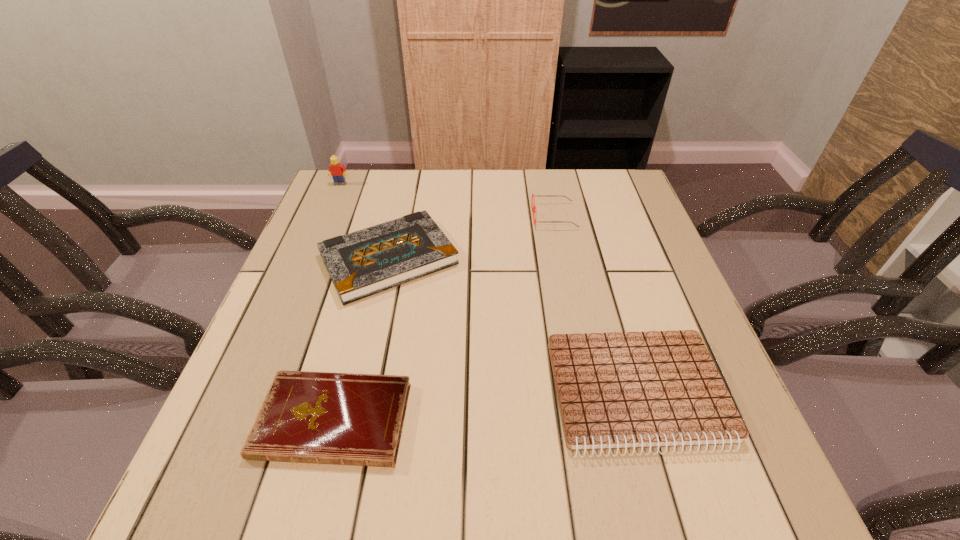
Where is `blank space located on the front-facing side of the spectacles`? This screenshot has width=960, height=540. blank space located on the front-facing side of the spectacles is located at coordinates (419, 216).

Where is `vacant position located on the back of the tallest notebook`? The height and width of the screenshot is (540, 960). vacant position located on the back of the tallest notebook is located at coordinates (400, 206).

What are the coordinates of `vacant region located on the back of the second shortest notebook` in the screenshot? It's located at (610, 298).

Find the location of `vacant point located on the back of the shortest notebook`. vacant point located on the back of the shortest notebook is located at coordinates coord(378,245).

Locate an element on the screen. The height and width of the screenshot is (540, 960). Lego at the far edge is located at coordinates (336, 170).

At what (x,y) coordinates should I click in order to perform the action: click on spectacles at the far edge. Please return your answer as a coordinate pair (x, y). The width and height of the screenshot is (960, 540). Looking at the image, I should click on (533, 207).

Where is `Lego located at the left edge`? Lego located at the left edge is located at coordinates (336, 170).

This screenshot has width=960, height=540. I want to click on object positioned at the right edge, so click(x=619, y=390).

Locate an element on the screen. This screenshot has height=540, width=960. object present at the far left corner is located at coordinates (x=336, y=170).

I want to click on object situated at the near left corner, so click(x=351, y=419).